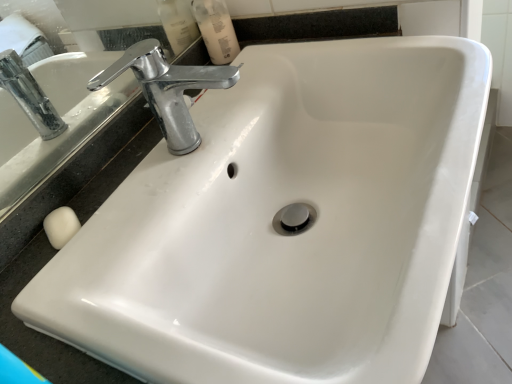
Where is `vacant location behind chrome metallic faucet at upper left`? vacant location behind chrome metallic faucet at upper left is located at coordinates (234, 92).